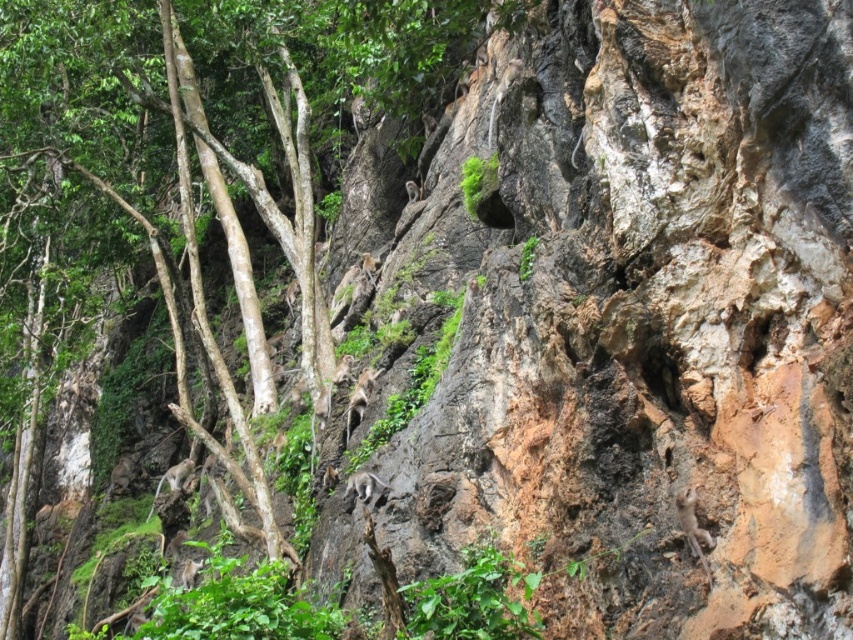
You are a hiker trying to reach the top of the cliff. You see the brown rough rock at upper center and the green leafy tree at center. Which object is closer to the base of the cliff?

The brown rough rock at upper center is positioned under the green leafy tree at center, meaning it is closer to the base of the cliff.

You are standing at the base of the cliff and notice two points marked on the cliff face. The first point is at coordinates point (773,266) and the second point is at point (300,285). Which point is closer to your current position?

Point (773,266) is closer to the camera than point (300,285), so the first point is closer to your position.